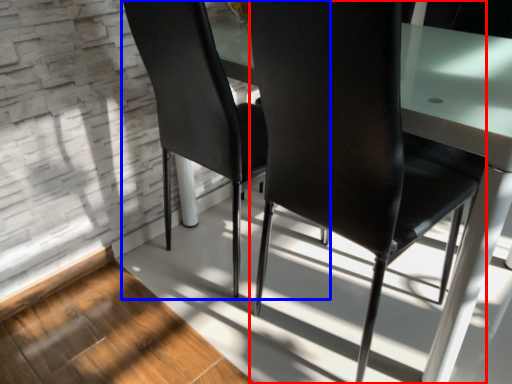
Question: Which object is closer to the camera taking this photo, chair (highlighted by a red box) or chair (highlighted by a blue box)?

Choices:
 (A) chair
 (B) chair

Answer: (A)